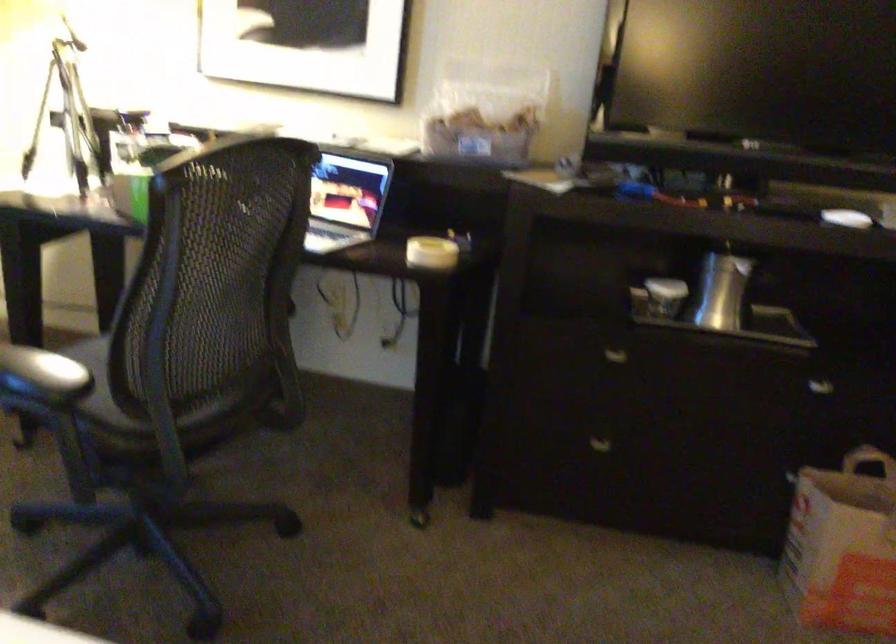
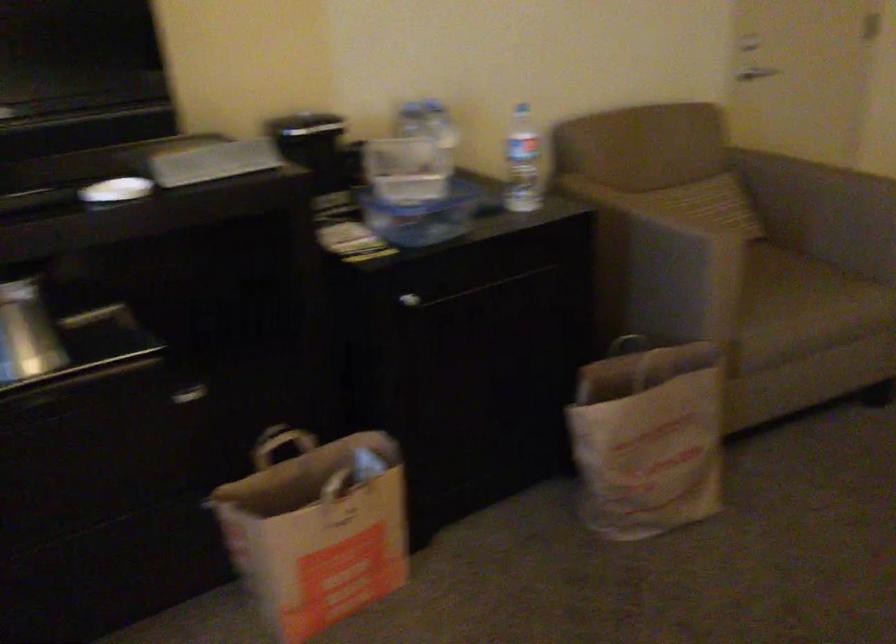
Question: The camera is either moving clockwise (left) or counter-clockwise (right) around the object. The first image is from the beginning of the video and the second image is from the end. Is the camera moving left or right when shooting the video?

Choices:
 (A) Left
 (B) Right

Answer: (A)